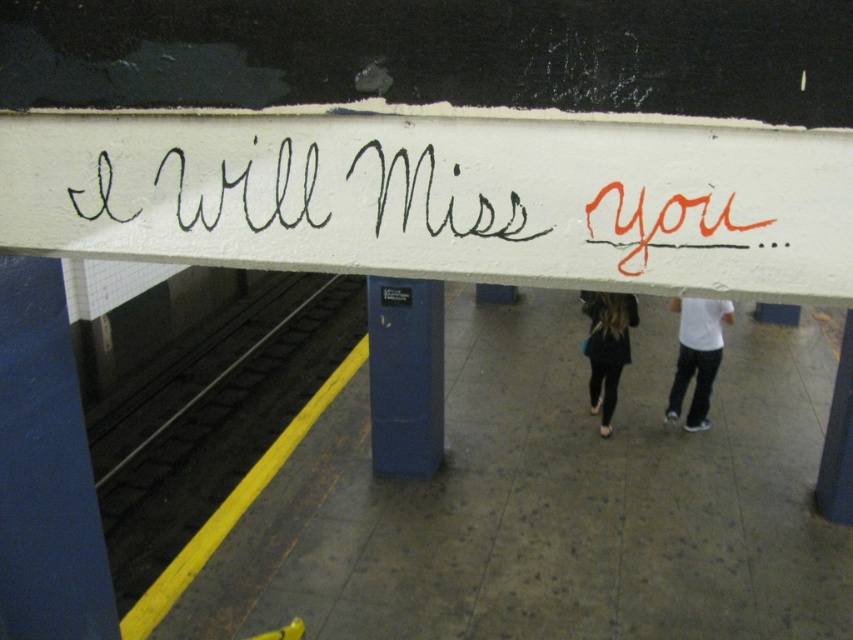
Can you confirm if white painted graffiti at upper center is wider than black leather pants at center?

Yes.

Is white painted graffiti at upper center closer to camera compared to black leather pants at center?

Yes, white painted graffiti at upper center is in front of black leather pants at center.

Between point (758, 196) and point (592, 316), which one is positioned behind?

Positioned behind is point (592, 316).

Find the location of a particular element. white painted graffiti at upper center is located at coordinates (440, 198).

Does yellow rubber at bottom left have a lesser width compared to black leather pants at center?

Incorrect, yellow rubber at bottom left's width is not less than black leather pants at center's.

Does point (212, 332) come in front of point (614, 364)?

No, it is not.

I want to click on yellow rubber at bottom left, so click(x=213, y=419).

Which of these two, white painted graffiti at upper center or blue metallic pillar at center, stands taller?

blue metallic pillar at center is taller.

Can you confirm if white painted graffiti at upper center is wider than blue metallic pillar at center?

Correct, the width of white painted graffiti at upper center exceeds that of blue metallic pillar at center.

Who is more distant from viewer, (697, 150) or (386, 348)?

Positioned behind is point (386, 348).

I want to click on white painted graffiti at upper center, so click(440, 198).